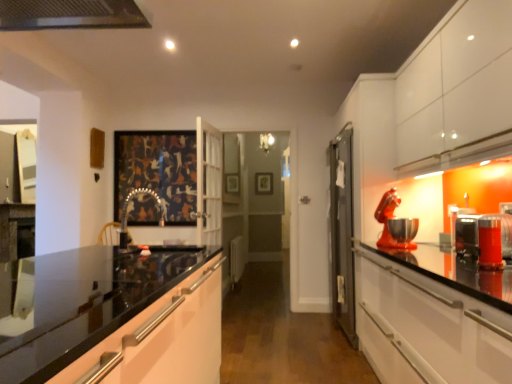
Question: Is metallic red stand mixer at right, which is the fourth appliance in front-to-back order, in contact with wooden picture frame at center, the 1th picture frame in the back-to-front sequence?

Choices:
 (A) no
 (B) yes

Answer: (A)

Question: Is the depth of metallic red stand mixer at right, which is the fourth appliance in front-to-back order, less than that of wooden picture frame at center, the 1th picture frame in the back-to-front sequence?

Choices:
 (A) no
 (B) yes

Answer: (B)

Question: From a real-world perspective, is metallic red stand mixer at right, which is the fourth appliance in front-to-back order, on wooden picture frame at center, the 2th picture frame in the front-to-back sequence?

Choices:
 (A) yes
 (B) no

Answer: (B)

Question: Is metallic red stand mixer at right, which is the fourth appliance in front-to-back order, further to camera compared to wooden picture frame at center, the 2th picture frame positioned from the left?

Choices:
 (A) no
 (B) yes

Answer: (A)

Question: Considering the relative sizes of metallic red stand mixer at right, the 1th appliance from the back, and wooden picture frame at center, the 1th picture frame in the back-to-front sequence, in the image provided, is metallic red stand mixer at right, the 1th appliance from the back, taller than wooden picture frame at center, the 1th picture frame in the back-to-front sequence,?

Choices:
 (A) no
 (B) yes

Answer: (A)

Question: Based on their positions, is metallic silver toaster at right, the 3th appliance in the front-to-back sequence, located to the left or right of metallic faucet at center?

Choices:
 (A) left
 (B) right

Answer: (B)

Question: From a real-world perspective, relative to metallic faucet at center, is metallic silver toaster at right, which is counted as the 2th appliance, starting from the back, vertically above or below?

Choices:
 (A) below
 (B) above

Answer: (A)

Question: In terms of height, does metallic silver toaster at right, which is counted as the 2th appliance, starting from the back, look taller or shorter compared to metallic faucet at center?

Choices:
 (A) tall
 (B) short

Answer: (B)

Question: From the image's perspective, is metallic silver toaster at right, the 3th appliance in the front-to-back sequence, positioned above or below metallic faucet at center?

Choices:
 (A) below
 (B) above

Answer: (A)

Question: Is point coord(475,226) positioned closer to the camera than point coord(504,235)?

Choices:
 (A) farther
 (B) closer

Answer: (A)

Question: Is metallic silver toaster at right, which is counted as the 2th appliance, starting from the back, in front of or behind metallic silver toaster at right, the second appliance from the front, in the image?

Choices:
 (A) front
 (B) behind

Answer: (B)

Question: Which is correct: metallic silver toaster at right, the 3th appliance in the front-to-back sequence, is inside metallic silver toaster at right, the second appliance from the front, or outside of it?

Choices:
 (A) outside
 (B) inside

Answer: (A)

Question: From the image's perspective, relative to metallic silver toaster at right, the third appliance positioned from the back, is metallic silver toaster at right, the 3th appliance in the front-to-back sequence, above or below?

Choices:
 (A) below
 (B) above

Answer: (A)

Question: From a real-world perspective, is metallic silver toaster at right, the second appliance from the front, physically located above or below metallic faucet at center?

Choices:
 (A) above
 (B) below

Answer: (B)

Question: In the image, is metallic silver toaster at right, the third appliance positioned from the back, positioned in front of or behind metallic faucet at center?

Choices:
 (A) front
 (B) behind

Answer: (A)